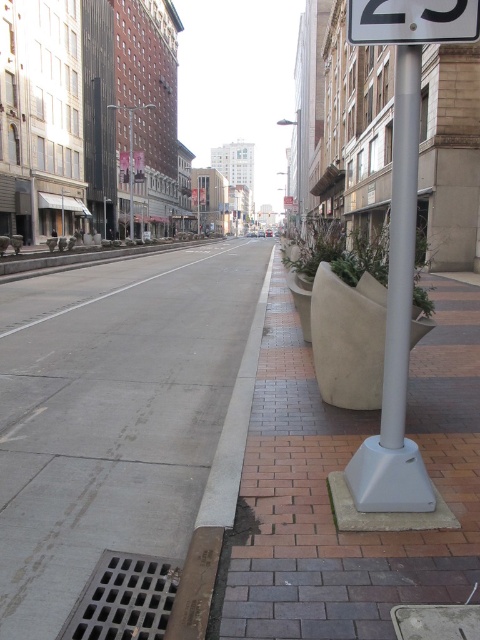
You are a delivery person standing on the gray concrete sidewalk at center and need to reach the white plastic sign at center right. Which direction should you move to get closer to the sign?

The gray concrete sidewalk at center is closer to the viewer than the white plastic sign at center right, so you should move forward away from the sidewalk towards the direction of the sign to get closer to the white plastic sign at center right.

You are standing on the sidewalk of the city street and want to walk from point A to point B. Point A is at coordinate point (x=424, y=20) and point B is at coordinate point (x=399, y=444). Which direction should you walk to get from point A to point B?

You should walk towards the right and slightly forward because point (x=399, y=444) is further away from the viewer compared to point (x=424, y=20).